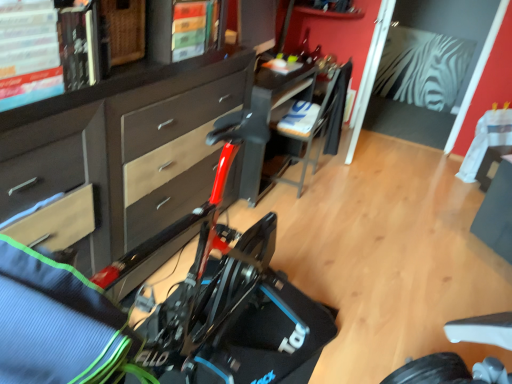
Question: From a real-world perspective, is matte brown cabinet at center physically below black plastic table at center?

Choices:
 (A) yes
 (B) no

Answer: (B)

Question: Is matte brown cabinet at center shorter than black plastic table at center?

Choices:
 (A) yes
 (B) no

Answer: (B)

Question: Is matte brown cabinet at center with black plastic table at center?

Choices:
 (A) yes
 (B) no

Answer: (B)

Question: Would you say matte brown cabinet at center is outside black plastic table at center?

Choices:
 (A) no
 (B) yes

Answer: (B)

Question: From the image's perspective, is matte brown cabinet at center under black plastic table at center?

Choices:
 (A) no
 (B) yes

Answer: (B)

Question: From their relative heights in the image, would you say black plastic table at center is taller or shorter than black plastic chair at center?

Choices:
 (A) short
 (B) tall

Answer: (A)

Question: Looking at the image, does black plastic table at center seem bigger or smaller compared to black plastic chair at center?

Choices:
 (A) big
 (B) small

Answer: (A)

Question: Is black plastic table at center in front of or behind black plastic chair at center in the image?

Choices:
 (A) front
 (B) behind

Answer: (A)

Question: From the image's perspective, is black plastic table at center positioned above or below black plastic chair at center?

Choices:
 (A) below
 (B) above

Answer: (A)

Question: Relative to black plastic table at center, is black plastic chair at center in front or behind?

Choices:
 (A) front
 (B) behind

Answer: (B)

Question: Considering the positions of black plastic chair at center and black plastic table at center in the image, is black plastic chair at center taller or shorter than black plastic table at center?

Choices:
 (A) tall
 (B) short

Answer: (A)

Question: From the image's perspective, is black plastic chair at center positioned above or below black plastic table at center?

Choices:
 (A) above
 (B) below

Answer: (A)

Question: Is black plastic chair at center wider or thinner than black plastic table at center?

Choices:
 (A) thin
 (B) wide

Answer: (A)

Question: From the image's perspective, is matte brown cabinet at center located above or below black plastic table at center?

Choices:
 (A) below
 (B) above

Answer: (A)

Question: Is matte brown cabinet at center inside the boundaries of black plastic table at center, or outside?

Choices:
 (A) outside
 (B) inside

Answer: (A)